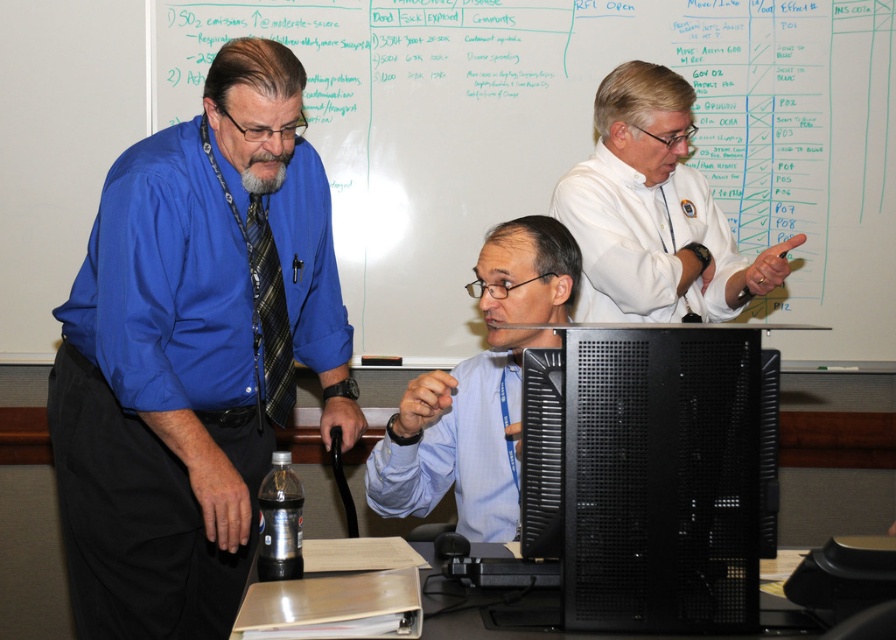
Can you confirm if whiteboard at upper center is bigger than plaid fabric tie at left?

Yes.

Is whiteboard at upper center closer to camera compared to plaid fabric tie at left?

No, whiteboard at upper center is further to the viewer.

Between point (444, 3) and point (253, 301), which one is positioned in front?

Point (253, 301) is in front.

Identify the location of whiteboard at upper center. (575, 138).

Who is higher up, whiteboard at upper center or light blue shirt at center?

whiteboard at upper center

Who is shorter, whiteboard at upper center or light blue shirt at center?

light blue shirt at center is shorter.

This screenshot has width=896, height=640. Identify the location of whiteboard at upper center. (575, 138).

The image size is (896, 640). Identify the location of whiteboard at upper center. (575, 138).

At what (x,y) coordinates should I click in order to perform the action: click on matte blue shirt at left. Please return your answer as a coordinate pair (x, y). Image resolution: width=896 pixels, height=640 pixels. Looking at the image, I should click on (194, 353).

Is point (156, 467) closer to viewer compared to point (490, 243)?

That is True.

Where is `matte blue shirt at left`? The width and height of the screenshot is (896, 640). matte blue shirt at left is located at coordinates (194, 353).